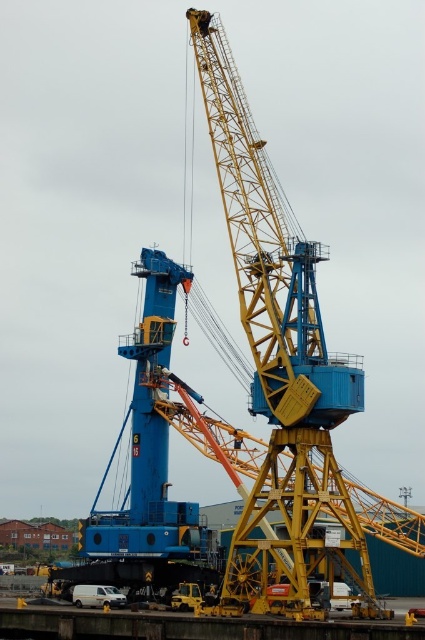
Question: Is yellow metallic crane at center further to the viewer compared to yellow metal dock at lower center?

Choices:
 (A) yes
 (B) no

Answer: (A)

Question: Which point is farther to the camera?

Choices:
 (A) yellow metallic crane at center
 (B) yellow metal dock at lower center

Answer: (A)

Question: In this image, where is yellow metallic crane at center located relative to yellow metal dock at lower center?

Choices:
 (A) above
 (B) below

Answer: (A)

Question: Is yellow metallic crane at center wider than yellow metal dock at lower center?

Choices:
 (A) no
 (B) yes

Answer: (A)

Question: Which of the following is the farthest from the observer?

Choices:
 (A) yellow metal dock at lower center
 (B) yellow metallic crane at center

Answer: (B)

Question: Among these objects, which one is nearest to the camera?

Choices:
 (A) yellow metal dock at lower center
 (B) yellow metallic crane at center

Answer: (A)